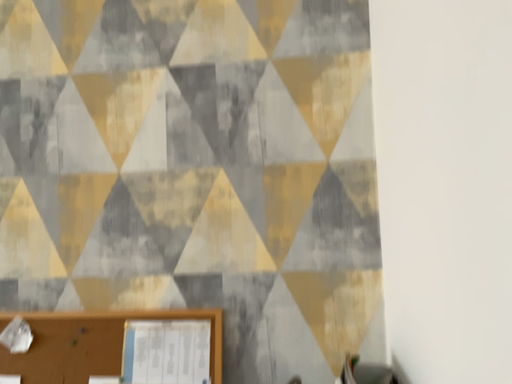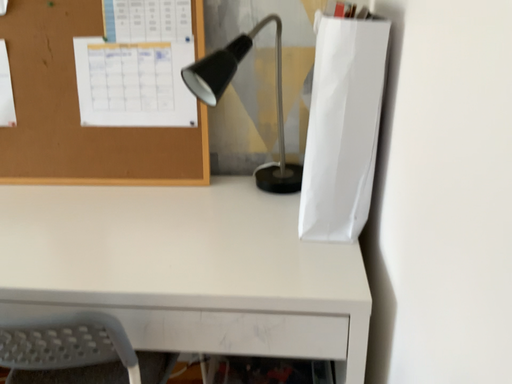
Question: How did the camera likely rotate when shooting the video?

Choices:
 (A) rotated downward
 (B) rotated upward

Answer: (A)